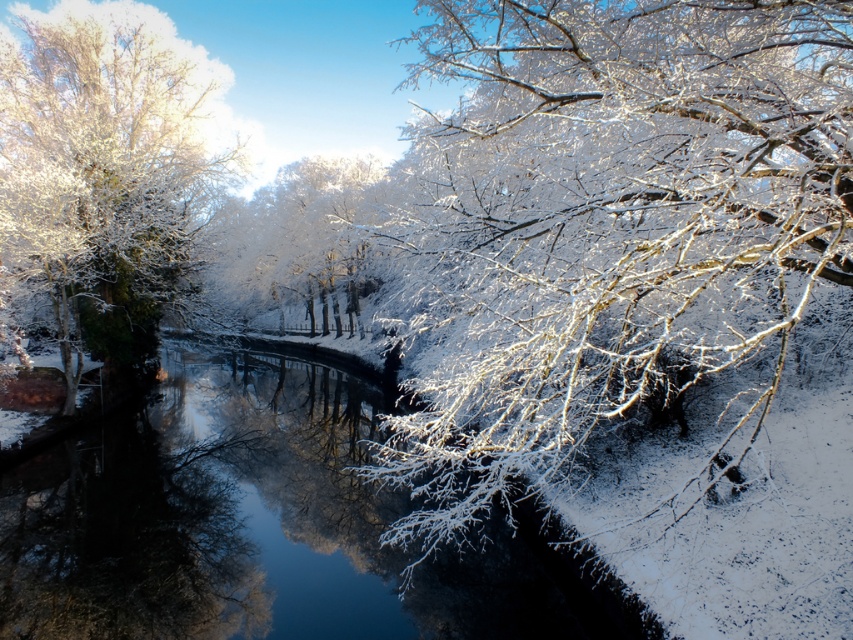
This screenshot has width=853, height=640. What do you see at coordinates (608, 220) in the screenshot?
I see `white frosty branches at upper right` at bounding box center [608, 220].

Between point (711, 100) and point (85, 308), which one is positioned in front?

Point (711, 100) is more forward.

Which is behind, point (451, 512) or point (42, 196)?

The point (42, 196) is more distant.

Where is `white frosty branches at upper right`? Image resolution: width=853 pixels, height=640 pixels. white frosty branches at upper right is located at coordinates (608, 220).

Is clear ice water at center shorter than white frosty tree at left?

Correct, clear ice water at center is not as tall as white frosty tree at left.

Is point (57, 602) positioned after point (132, 209)?

No.

Is point (56, 556) less distant than point (91, 291)?

Yes, point (56, 556) is closer to viewer.

Identify the location of clear ice water at center. This screenshot has height=640, width=853. (256, 524).

Is white frosty branches at upper right bigger than clear ice water at center?

Yes.

Between point (614, 49) and point (480, 612), which one is positioned in front?

Point (614, 49) is more forward.

Who is more forward, (601,144) or (383,600)?

Point (601,144)

Where is `white frosty branches at upper right`? This screenshot has height=640, width=853. white frosty branches at upper right is located at coordinates (x=608, y=220).